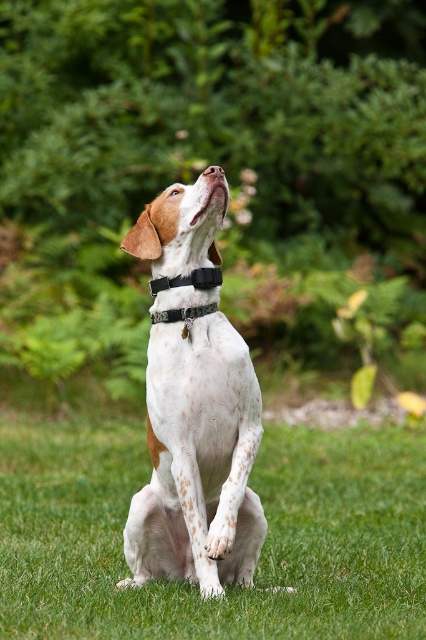
Between white speckled fur at center and black fabric neckband at center, which one has less height?

With less height is black fabric neckband at center.

Who is taller, white speckled fur at center or black fabric neckband at center?

With more height is white speckled fur at center.

At what (x,y) coordinates should I click in order to perform the action: click on white speckled fur at center. Please return your answer as a coordinate pair (x, y). This screenshot has width=426, height=640. Looking at the image, I should click on (196, 449).

This screenshot has height=640, width=426. What do you see at coordinates (259, 556) in the screenshot? I see `green grass at center` at bounding box center [259, 556].

Is green grass at center to the left of black fabric neckband at center from the viewer's perspective?

Yes, green grass at center is to the left of black fabric neckband at center.

Which is in front, point (210, 634) or point (192, 275)?

Point (210, 634)

This screenshot has width=426, height=640. I want to click on green grass at center, so (259, 556).

Who is more distant from viewer, (x=86, y=573) or (x=253, y=417)?

Answer: The point (x=86, y=573) is more distant.

The width and height of the screenshot is (426, 640). Describe the element at coordinates (259, 556) in the screenshot. I see `green grass at center` at that location.

Locate an element on the screen. green grass at center is located at coordinates (259, 556).